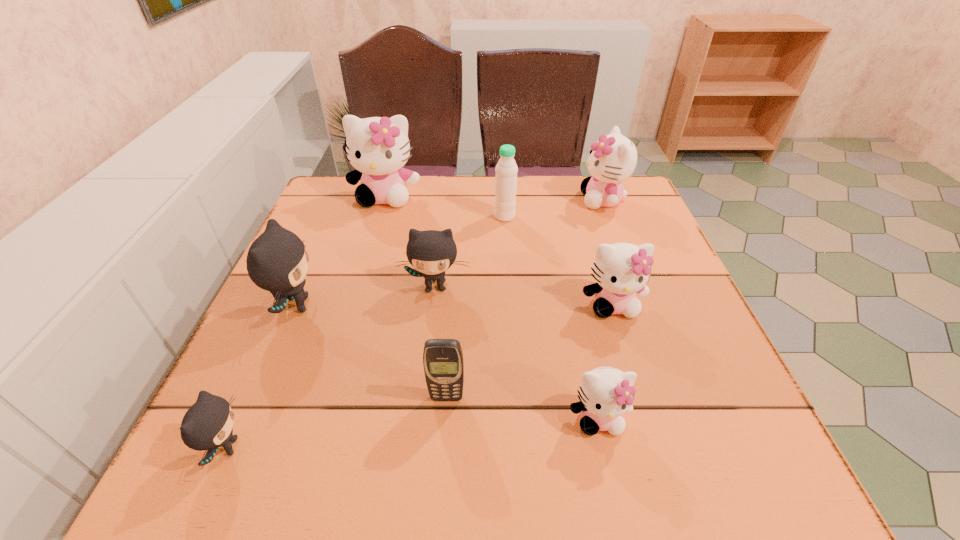
Where is `the closest object to the third smallest white kitten`? the closest object to the third smallest white kitten is located at coordinates (506, 169).

The image size is (960, 540). Identify the location of kitten that is the closest to the smallest gray kitten. (277, 261).

Find the location of a particular element. kitten that is the fourth closest to the smallest white kitten is located at coordinates (207, 425).

Identify the location of white kitten that can be found as the third closest to the water bottle. (621, 270).

In order to click on the third closest white kitten to the white water bottle in this screenshot , I will do `click(621, 270)`.

Locate an element on the screen. This screenshot has width=960, height=540. the third closest gray kitten to the biggest white kitten is located at coordinates (207, 425).

Point out which gray kitten is positioned as the nearest to the rightmost gray kitten. Please provide its 2D coordinates. Your answer should be formatted as a tuple, i.e. [(x, y)], where the tuple contains the x and y coordinates of a point satisfying the conditions above.

[(277, 261)]

Where is `free space that satisfies the following two spatial constraints: 1. on the front-facing side of the third smallest white kitten; 2. on the front-facing side of the nearest white kitten`? The image size is (960, 540). free space that satisfies the following two spatial constraints: 1. on the front-facing side of the third smallest white kitten; 2. on the front-facing side of the nearest white kitten is located at coordinates (686, 418).

Locate an element on the screen. The width and height of the screenshot is (960, 540). free region that satisfies the following two spatial constraints: 1. on the front-facing side of the third smallest white kitten; 2. on the front-facing side of the smallest white kitten is located at coordinates (686, 418).

Where is `vacant area in the image that satisfies the following two spatial constraints: 1. on the front-facing side of the second nearest white kitten; 2. on the front-facing side of the smallest gray kitten`? The image size is (960, 540). vacant area in the image that satisfies the following two spatial constraints: 1. on the front-facing side of the second nearest white kitten; 2. on the front-facing side of the smallest gray kitten is located at coordinates (657, 448).